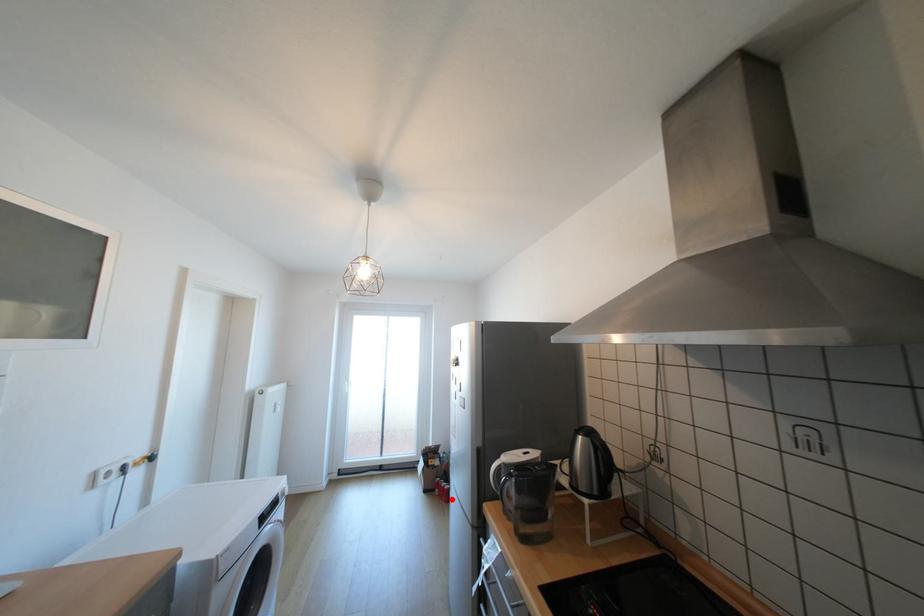
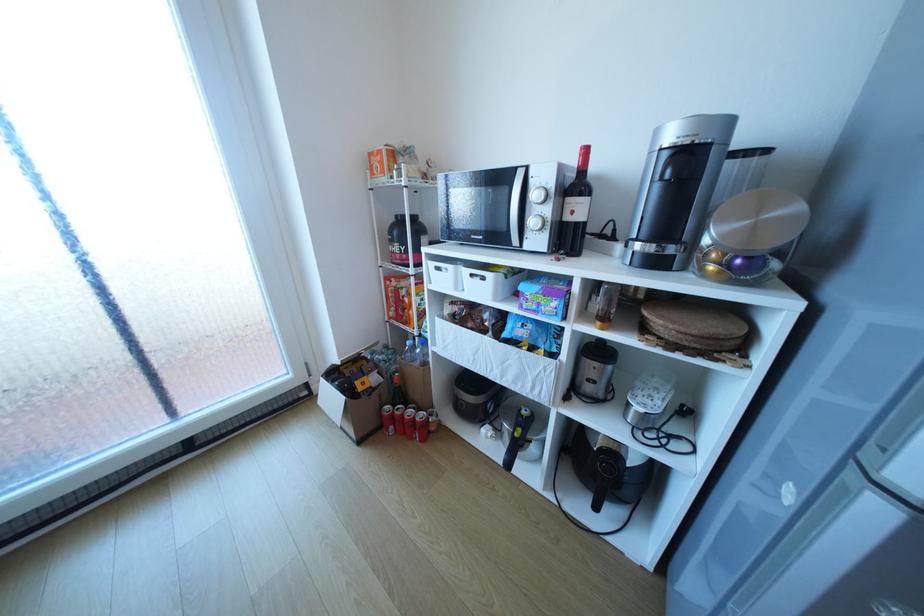
Question: I am providing you with two images of the same scene from different viewpoints. In image1, a red point is highlighted. Considering the same 3D point in image2, which of the following is correct?

Choices:
 (A) It is closer
 (B) It is farther

Answer: (A)